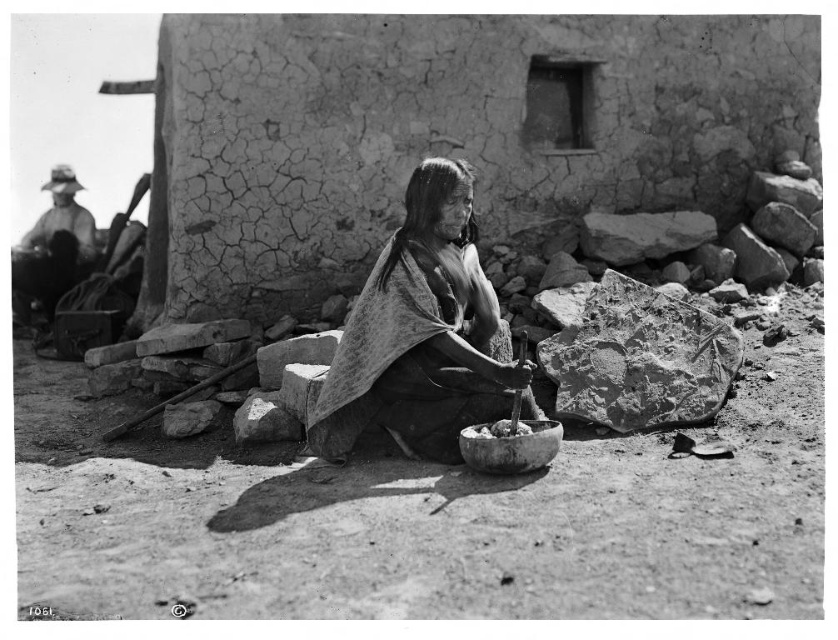
Based on the photo, you are an anthropologist examining the photograph. You notice the smooth fabric shawl at center and the smooth white stones at center. Which object takes up more horizontal space in the image?

The smooth fabric shawl at center has a greater width than the smooth white stones at center, so it takes up more horizontal space in the image.

You are an archaeologist examining a historical photo. You need to locate the smooth clay bowl at center. What are its coordinates in the image?

The smooth clay bowl at center is located at coordinates point (x=510, y=445).

You are standing at the camera position and want to place a 10 feet long ladder between the smooth clay bowl at center and the camera. Is the distance sufficient to fit the ladder horizontally?

The smooth clay bowl at center and camera are 12.50 feet apart, so yes, the 10 feet long ladder can be placed between them horizontally as the distance is sufficient.